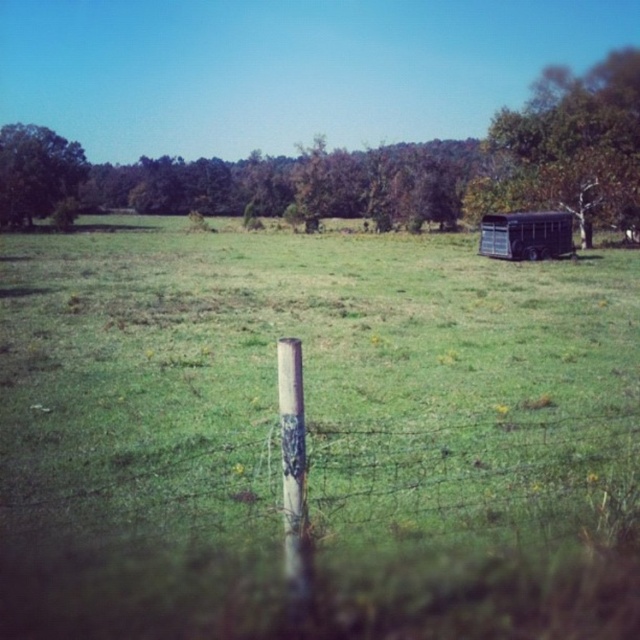
Is green leafy tree at upper right bigger than metallic trailer at right?

Indeed, green leafy tree at upper right has a larger size compared to metallic trailer at right.

Between point (536, 196) and point (552, 227), which one is positioned in front?

Positioned in front is point (552, 227).

Image resolution: width=640 pixels, height=640 pixels. In order to click on green leafy tree at upper right in this screenshot , I will do `click(570, 147)`.

Is point (602, 179) farther from camera compared to point (284, 337)?

Yes, it is.

Does green leafy tree at upper right have a greater height compared to white wood pole at center?

Yes, green leafy tree at upper right is taller than white wood pole at center.

The height and width of the screenshot is (640, 640). Identify the location of green leafy tree at upper right. (570, 147).

Who is more distant from viewer, (164, 513) or (536, 131)?

The point (536, 131) is more distant.

Who is positioned more to the right, wooden post at center or green leafy tree at upper right?

green leafy tree at upper right is more to the right.

The width and height of the screenshot is (640, 640). Identify the location of wooden post at center. (474, 476).